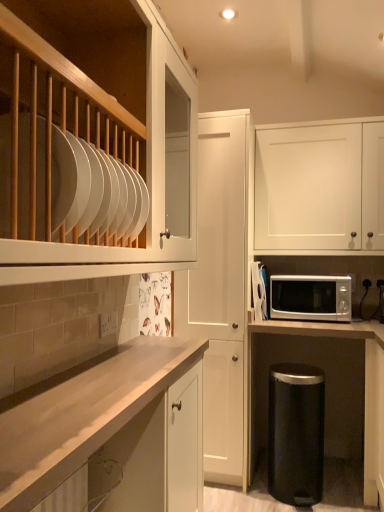
Question: Looking at their shapes, would you say black matte trash can at lower right is wider or thinner than light wood countertop at center, marked as the 3th cabinetry in a back-to-front arrangement?

Choices:
 (A) wide
 (B) thin

Answer: (A)

Question: From the image's perspective, relative to light wood countertop at center, the third cabinetry in the right-to-left sequence, is black matte trash can at lower right above or below?

Choices:
 (A) above
 (B) below

Answer: (B)

Question: Considering the real-world distances, which object is farthest from the silver metallic microwave at lower right?

Choices:
 (A) light wood countertop at center, marked as the 3th cabinetry in a back-to-front arrangement
 (B) white glossy microwave at center
 (C) white matte cabinet at center, which is counted as the 2th cabinetry, starting from the left
 (D) black matte trash can at lower right
 (E) white matte cabinet at upper right, acting as the 1th cabinetry starting from the right

Answer: (A)

Question: Which of these objects is positioned closest to the black matte trash can at lower right?

Choices:
 (A) white glossy microwave at center
 (B) white matte cabinet at upper right, acting as the 1th cabinetry starting from the right
 (C) silver metallic microwave at lower right
 (D) white matte cabinet at center, which is counted as the 2th cabinetry, starting from the left
 (E) light wood countertop at center, the third cabinetry in the right-to-left sequence

Answer: (D)